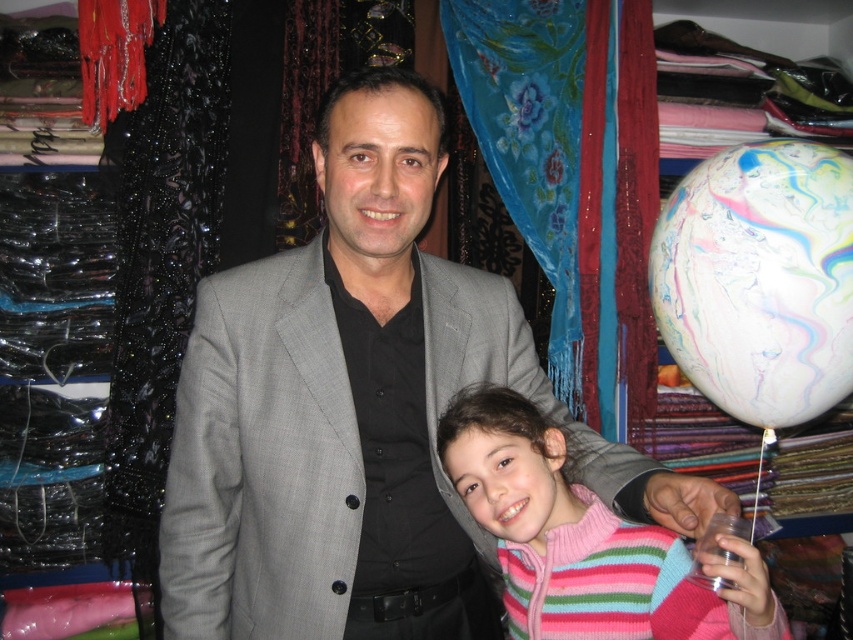
You are organizing a party and need to place a decoration between the pink striped sweater at center and the transparent plastic cup at lower right. Where should you place it to be centered between them?

The decoration should be placed between the pink striped sweater at center and the transparent plastic cup at lower right, centered exactly halfway between the two objects.

You are organizing items in the fabric store and need to place the gray woolen suit at center and the transparent plastic cup at lower right on a shelf. If the shelf has limited space, which item should you place first to maximize shelf usage?

The gray woolen suit at center has a larger size compared to the transparent plastic cup at lower right, so you should place the gray woolen suit at center first to ensure there is enough space left for the smaller transparent plastic cup at lower right.